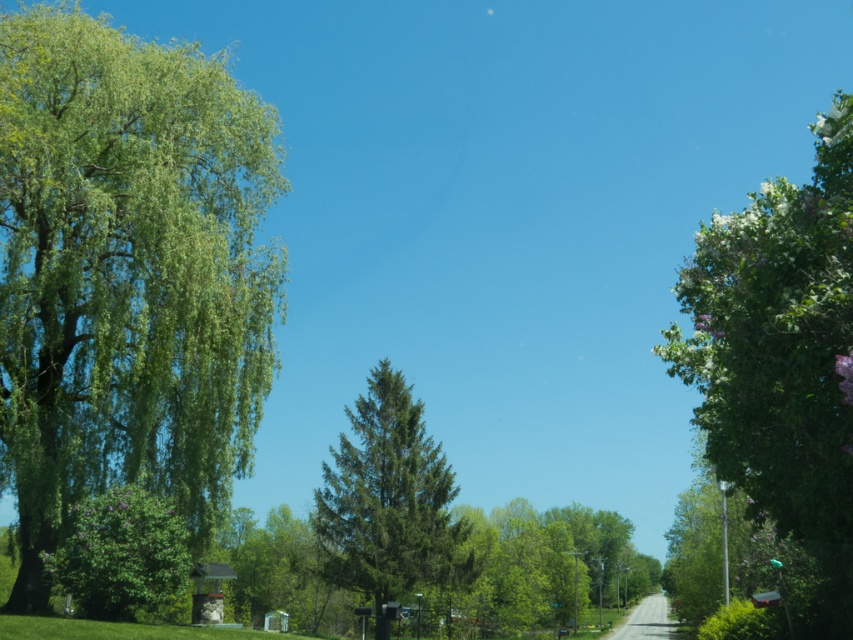
You are a bird looking for a place to land. You see the green leafy tree at right and the green matte tree at center. Which tree is farther away from the other?

The green leafy tree at right and the green matte tree at center are 33.94 meters apart, so they are both far away from each other.

You are standing at the center of the image and want to walk towards the green leafy tree at left. Which direction should you face to head directly towards it?

You should face towards the left direction to head directly towards the green leafy tree at left, as its position is at point (126,273) which is located on the left side of the image.